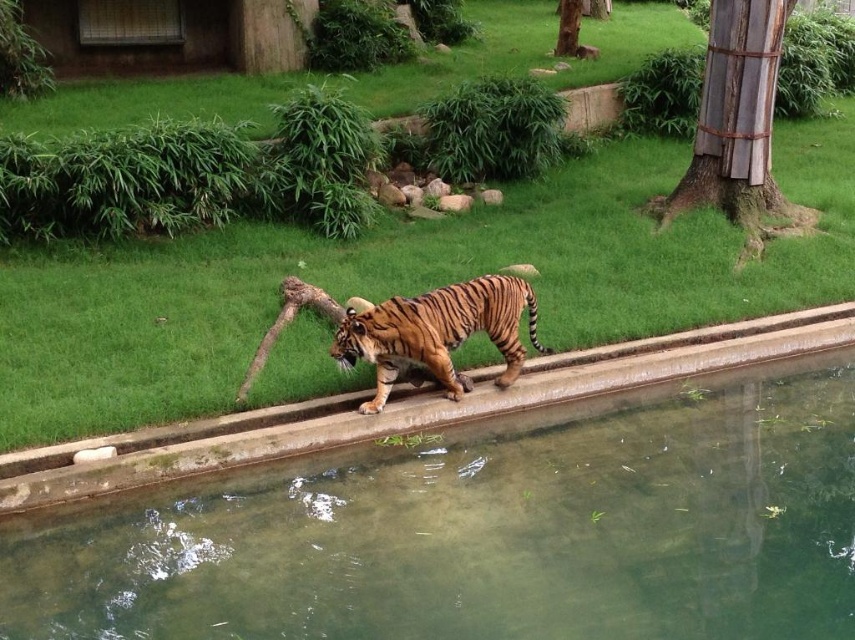
Question: Is clear glass water at center bigger than green grass at center?

Choices:
 (A) yes
 (B) no

Answer: (B)

Question: Does clear glass water at center appear on the right side of green grass at center?

Choices:
 (A) yes
 (B) no

Answer: (B)

Question: Where is green grass at center located in relation to orange-brown striped tiger at center in the image?

Choices:
 (A) above
 (B) below

Answer: (A)

Question: Which of the following is the farthest from the observer?

Choices:
 (A) (252, 614)
 (B) (558, 220)

Answer: (B)

Question: Estimate the real-world distances between objects in this image. Which object is closer to the orange-brown striped tiger at center?

Choices:
 (A) green grass at center
 (B) clear glass water at center

Answer: (B)

Question: Based on their relative distances, which object is nearer to the orange-brown striped tiger at center?

Choices:
 (A) clear glass water at center
 (B) green grass at center

Answer: (A)